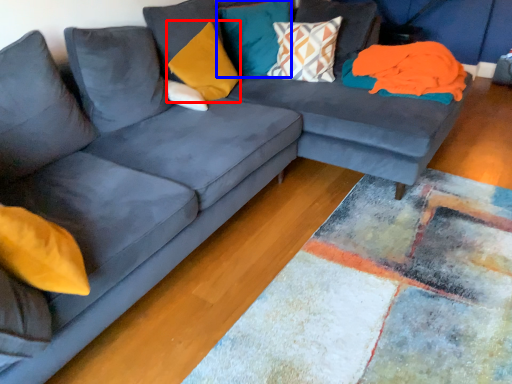
Question: Which object is closer to the camera taking this photo, pillow (highlighted by a red box) or pillow (highlighted by a blue box)?

Choices:
 (A) pillow
 (B) pillow

Answer: (A)